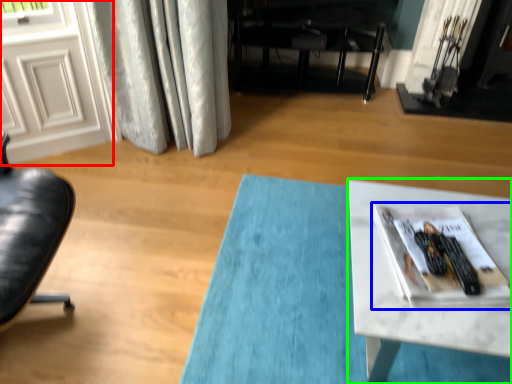
Question: Which is nearer to the screen door (highlighted by a red box)? magazine (highlighted by a blue box) or table (highlighted by a green box).

Choices:
 (A) magazine
 (B) table

Answer: (B)